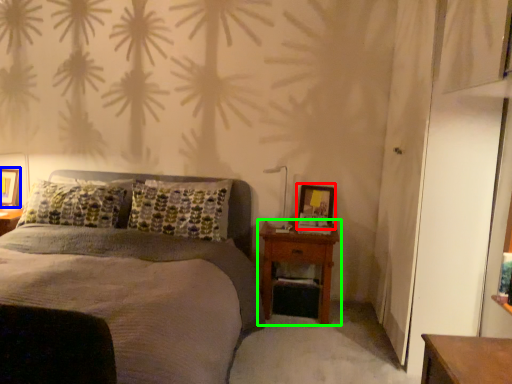
Question: Which object is positioned farthest from picture frame (highlighted by a red box)? Select from picture frame (highlighted by a blue box) and nightstand (highlighted by a green box).

Choices:
 (A) picture frame
 (B) nightstand

Answer: (A)